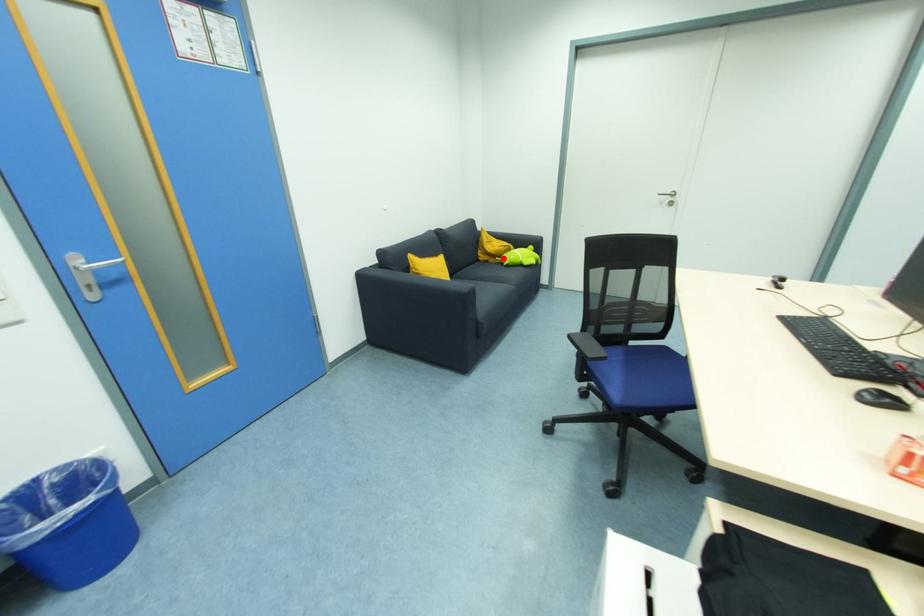
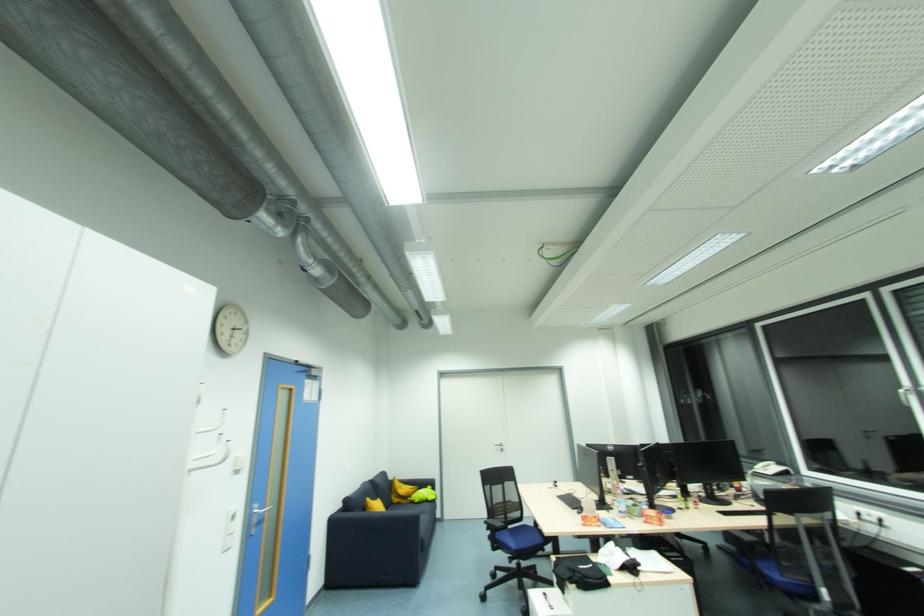
Question: A red point is marked in image1. In image2, is the corresponding 3D point closer to the camera or farther? Reply with the corresponding letter.

Choices:
 (A) The corresponding 3D point is closer.
 (B) The corresponding 3D point is farther.

Answer: (B)